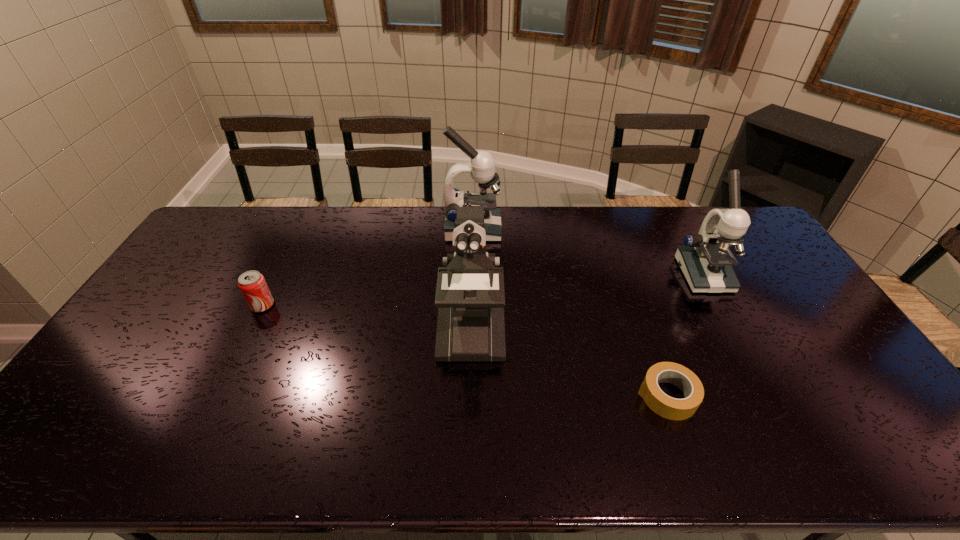
I want to click on free point located 0.110m at the edge of the nearest object, so click(x=595, y=396).

Where is `free space located 0.050m at the edge of the nearest object`? This screenshot has width=960, height=540. free space located 0.050m at the edge of the nearest object is located at coordinates (618, 396).

Where is `object located at the far edge`? The width and height of the screenshot is (960, 540). object located at the far edge is located at coordinates (481, 166).

At what (x,y) coordinates should I click in order to perform the action: click on free region at the far edge of the desktop. Please return your answer as a coordinate pair (x, y). The height and width of the screenshot is (540, 960). Looking at the image, I should click on (267, 223).

In the image, there is a desktop. Where is `vacant space at the left edge`? Image resolution: width=960 pixels, height=540 pixels. vacant space at the left edge is located at coordinates (214, 252).

You are a GUI agent. You are given a task and a screenshot of the screen. Output one action in this format:
    pyautogui.click(x=<x>, y=<y>)
    Task: Click on the vacant space at the far left corner
    
    Given the screenshot: What is the action you would take?
    pyautogui.click(x=226, y=212)

The image size is (960, 540). Identify the location of free space between the farthest object and the fourth tallest object. (368, 267).

The width and height of the screenshot is (960, 540). Find the location of `free space that is in between the second object from right to left and the farthest object`. free space that is in between the second object from right to left and the farthest object is located at coordinates (569, 313).

What are the coordinates of `unoccupied area between the rightmost microscope and the shortest object` in the screenshot? It's located at (684, 335).

The width and height of the screenshot is (960, 540). In order to click on vacant point located between the farthest microscope and the rightmost object in this screenshot , I will do `click(588, 252)`.